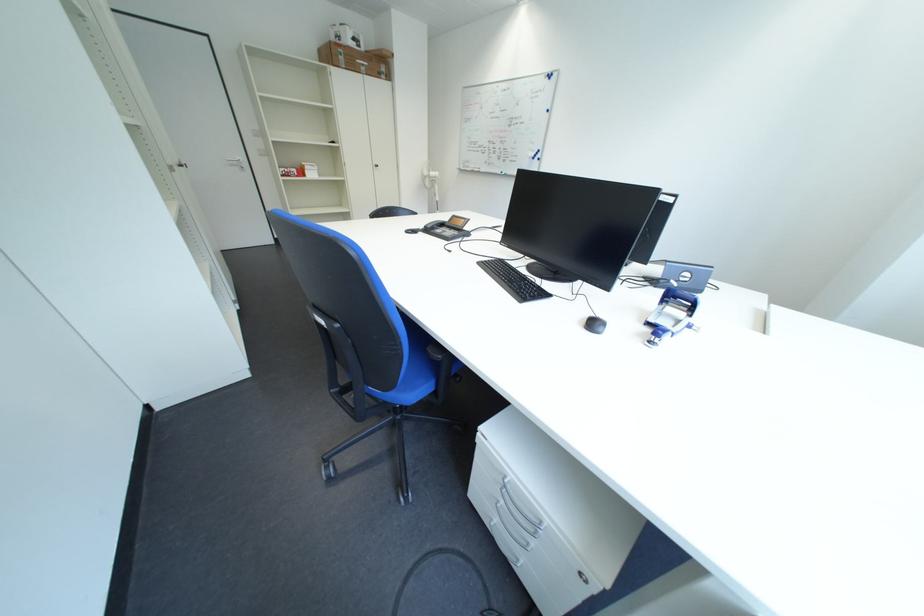
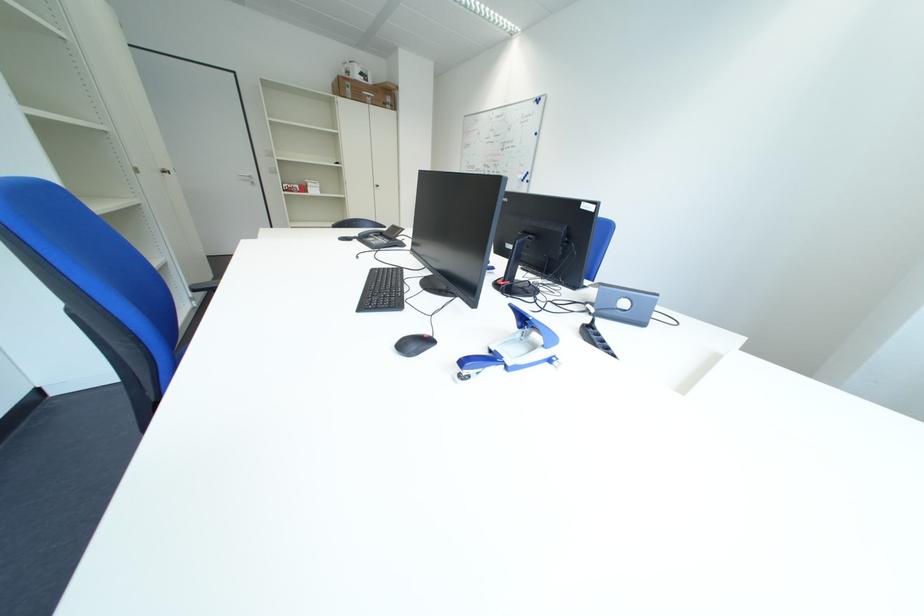
Find the pixel in the second image that matches the point at 605,326 in the first image.

(426, 346)